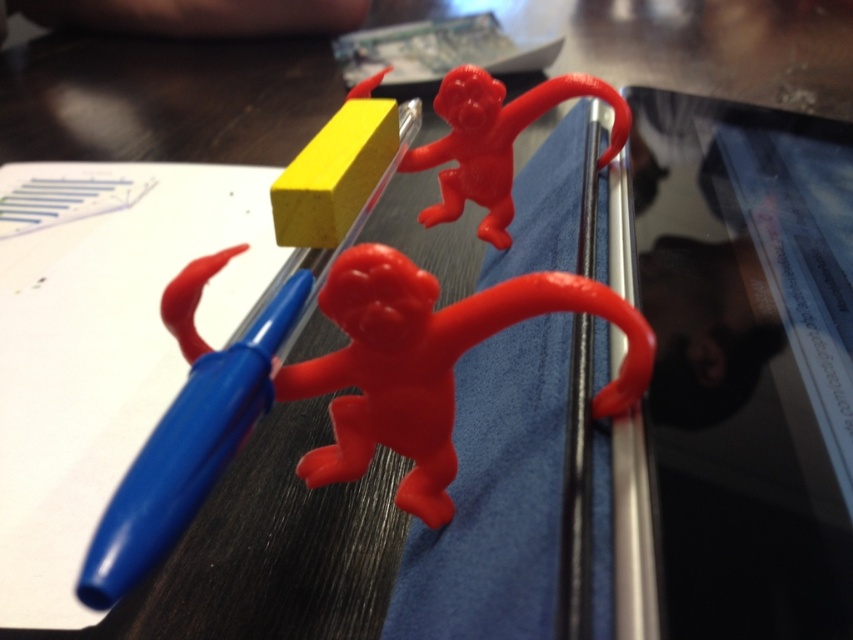
You are organizing a desk and need to place the blue plastic pencil at left and the matte plastic monkey at upper center into a drawer. The drawer has a width of 5 cm. Which object might not fit if placed sideways?

The matte plastic monkey at upper center might not fit in the drawer since it has a greater width than the blue plastic pencil at left according to the description.

You are organizing a desk and want to place both the matte plastic monkey at center and the matte plastic monkey at upper center in a row without overlapping. Which monkey should be placed first to the left to ensure they fit properly?

The matte plastic monkey at upper center should be placed first to the left because it is narrower than the matte plastic monkey at center, allowing the wider one to fit next without overlapping.